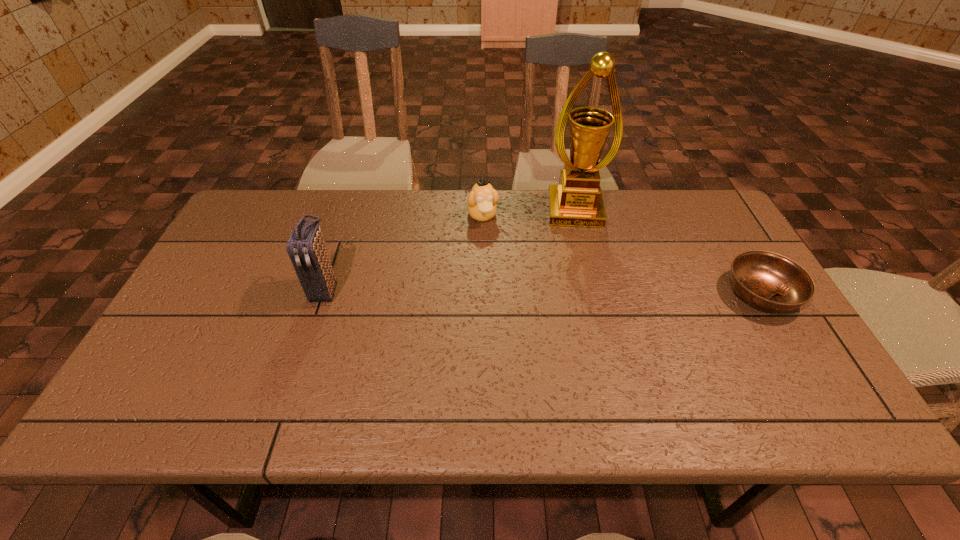
In order to click on clutch bag in this screenshot , I will do `click(306, 248)`.

Identify the location of the leftmost object. (306, 248).

Identify the location of the rightmost object. (768, 281).

This screenshot has height=540, width=960. In order to click on the shortest object in this screenshot , I will do `click(768, 281)`.

Locate an element on the screen. This screenshot has width=960, height=540. the third tallest object is located at coordinates tap(482, 200).

The width and height of the screenshot is (960, 540). Find the location of `duckling`. duckling is located at coordinates (482, 200).

Locate an element on the screen. The image size is (960, 540). the tallest object is located at coordinates (577, 201).

Find the location of `award`. award is located at coordinates (577, 201).

Find the location of a particular element. This screenshot has width=960, height=540. vacant area situated 0.210m with the zip open on the second tallest object is located at coordinates (295, 383).

The width and height of the screenshot is (960, 540). Find the location of `vacant space situated on the left of the rightmost object`. vacant space situated on the left of the rightmost object is located at coordinates (614, 293).